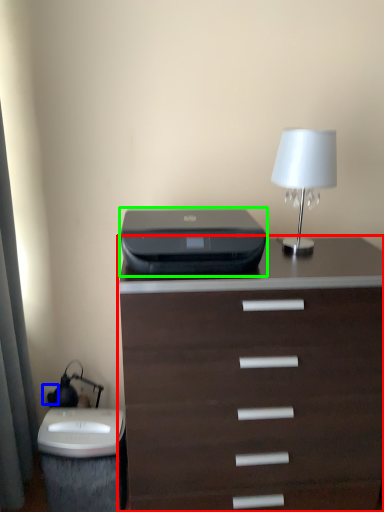
Question: Which is nearer to the chest of drawers (highlighted by a red box)? electric outlet (highlighted by a blue box) or printer (highlighted by a green box).

Choices:
 (A) electric outlet
 (B) printer

Answer: (B)